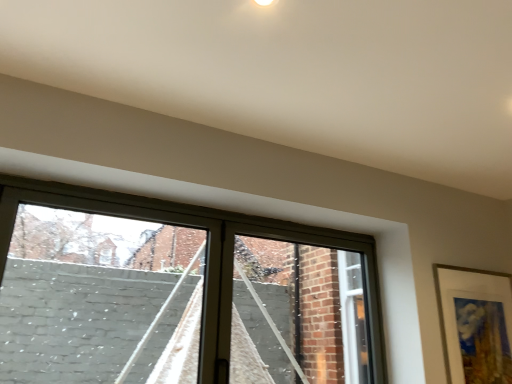
The height and width of the screenshot is (384, 512). What are the coordinates of `matte white picture frame at right` in the screenshot? It's located at (473, 317).

The height and width of the screenshot is (384, 512). Describe the element at coordinates (473, 317) in the screenshot. I see `matte white picture frame at right` at that location.

Find the location of `clear glass window at center`. clear glass window at center is located at coordinates pyautogui.click(x=178, y=293).

The height and width of the screenshot is (384, 512). What do you see at coordinates (178, 293) in the screenshot?
I see `clear glass window at center` at bounding box center [178, 293].

In order to face clear glass window at center, should I rotate leftwards or rightwards?

To face it directly, rotate left by 19.510 degrees.

Find the location of `matte white picture frame at right`. matte white picture frame at right is located at coordinates (473, 317).

Based on their positions, is matte white picture frame at right located to the left or right of clear glass window at center?

Clearly, matte white picture frame at right is on the right of clear glass window at center in the image.

Considering their positions, is matte white picture frame at right located in front of or behind clear glass window at center?

In the image, matte white picture frame at right appears behind clear glass window at center.

Does point (439, 301) appear closer or farther from the camera than point (137, 366)?

Clearly, point (439, 301) is closer to the camera than point (137, 366).

Based on the photo, from the image's perspective, which one is positioned higher, matte white picture frame at right or clear glass window at center?

clear glass window at center is shown above in the image.

From a real-world perspective, which is physically above, matte white picture frame at right or clear glass window at center?

In real-world perspective, clear glass window at center is above.

Does matte white picture frame at right have a greater width compared to clear glass window at center?

No, matte white picture frame at right is not wider than clear glass window at center.

Can you confirm if matte white picture frame at right is taller than clear glass window at center?

In fact, matte white picture frame at right may be shorter than clear glass window at center.

Can you confirm if matte white picture frame at right is bigger than clear glass window at center?

Incorrect, matte white picture frame at right is not larger than clear glass window at center.

Is matte white picture frame at right inside the boundaries of clear glass window at center, or outside?

The correct answer is: outside.

Can you see matte white picture frame at right touching clear glass window at center?

→ There is a gap between matte white picture frame at right and clear glass window at center.

Does matte white picture frame at right turn towards clear glass window at center?

No, matte white picture frame at right is not oriented towards clear glass window at center.

Can you tell me how much matte white picture frame at right and clear glass window at center differ in facing direction?

There is a 1.56-degree angle between the facing directions of matte white picture frame at right and clear glass window at center.

This screenshot has height=384, width=512. I want to click on picture frame below the clear glass window at center (from the image's perspective), so click(x=473, y=317).

Considering the relative positions of clear glass window at center and matte white picture frame at right in the image provided, is clear glass window at center to the right of matte white picture frame at right from the viewer's perspective?

Incorrect, clear glass window at center is not on the right side of matte white picture frame at right.

In the image, is clear glass window at center positioned in front of or behind matte white picture frame at right?

Visually, clear glass window at center is located in front of matte white picture frame at right.

Which is closer to the camera, (x=238, y=215) or (x=499, y=332)?

Point (x=238, y=215) appears to be closer to the viewer than point (x=499, y=332).

From the image's perspective, between clear glass window at center and matte white picture frame at right, who is located below?

matte white picture frame at right.

From a real-world perspective, is clear glass window at center physically located above or below matte white picture frame at right?

Clearly, from a real-world perspective, clear glass window at center is above matte white picture frame at right.

Which object is wider, clear glass window at center or matte white picture frame at right?

With larger width is clear glass window at center.

In the scene shown: Does clear glass window at center have a greater height compared to matte white picture frame at right?

Result: Indeed, clear glass window at center has a greater height compared to matte white picture frame at right.

Can you confirm if clear glass window at center is smaller than matte white picture frame at right?

Actually, clear glass window at center might be larger than matte white picture frame at right.

Is matte white picture frame at right surrounded by clear glass window at center?

Definitely not — matte white picture frame at right is not inside clear glass window at center.

Is clear glass window at center not close to matte white picture frame at right?

Yes.

Is clear glass window at center aimed at matte white picture frame at right?

No, clear glass window at center is not facing towards matte white picture frame at right.

Where is `window in front of the matte white picture frame at right`? window in front of the matte white picture frame at right is located at coordinates (178, 293).

At what (x,y) coordinates should I click in order to perform the action: click on window above the matte white picture frame at right (from the image's perspective). Please return your answer as a coordinate pair (x, y). The image size is (512, 384). Looking at the image, I should click on (178, 293).

This screenshot has width=512, height=384. I want to click on picture frame that is below the clear glass window at center (from the image's perspective), so click(x=473, y=317).